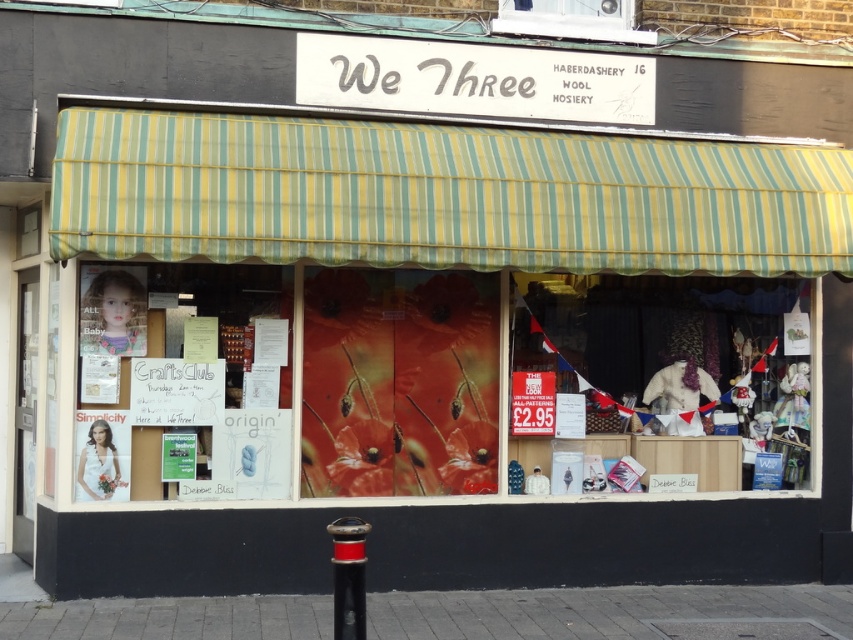
Consider the image. You are standing outside the shop and want to see through the transparent plastic window at upper center. Is the point at coordinates (572,19) on the window?

Yes, the transparent plastic window at upper center is represented by point (572,19), so the point is on the window.

You are a customer entering the store and see the matte white dress at center and the black plastic pole at lower center. Which object is taller?

The matte white dress at center is much taller than the black plastic pole at lower center.

You are a customer standing in front of the shop window. You see the matte white dress at center and the black plastic pole at lower center. Which object is positioned to the right side of the other?

The matte white dress at center is to the right of the black plastic pole at lower center.